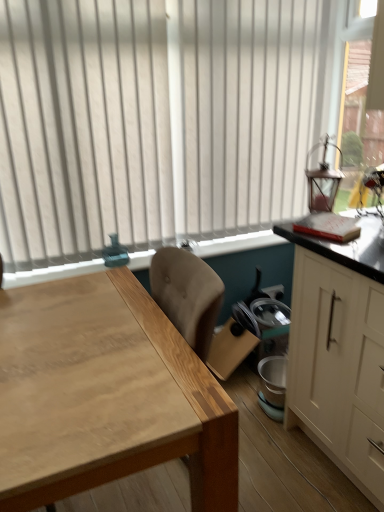
What do you see at coordinates (339, 351) in the screenshot? I see `white matte cabinet at right` at bounding box center [339, 351].

Measure the distance between natural wood table at center and camera.

natural wood table at center and camera are 29.27 inches apart from each other.

You are a GUI agent. You are given a task and a screenshot of the screen. Output one action in this format:
    pyautogui.click(x=<x>, y=<y>)
    Task: Click on the white matte cabinet at right
    
    Given the screenshot: What is the action you would take?
    pyautogui.click(x=339, y=351)

Is white vertical blinds at upper center in contact with white matte cabinet at right?

No, white vertical blinds at upper center is not in contact with white matte cabinet at right.

Is white vertical blinds at upper center thinner than white matte cabinet at right?

Correct, the width of white vertical blinds at upper center is less than that of white matte cabinet at right.

At what (x,y) coordinates should I click in order to perform the action: click on window on the left of white matte cabinet at right. Please return your answer as a coordinate pair (x, y). Looking at the image, I should click on (153, 121).

Based on their positions, is white vertical blinds at upper center located to the left or right of white matte cabinet at right?

From the image, it's evident that white vertical blinds at upper center is to the left of white matte cabinet at right.

Would you say natural wood table at center is to the left or to the right of white matte cabinet at right in the picture?

Clearly, natural wood table at center is on the left of white matte cabinet at right in the image.

Considering the relative sizes of natural wood table at center and white matte cabinet at right in the image provided, is natural wood table at center smaller than white matte cabinet at right?

Incorrect, natural wood table at center is not smaller in size than white matte cabinet at right.

Consider the image. Considering the sizes of objects natural wood table at center and white matte cabinet at right in the image provided, who is wider, natural wood table at center or white matte cabinet at right?

Wider between the two is natural wood table at center.

Can you confirm if natural wood table at center is taller than white matte cabinet at right?

In fact, natural wood table at center may be shorter than white matte cabinet at right.

Does natural wood table at center appear on the left side of clear glass lantern at upper right?

Yes.

Considering the sizes of objects natural wood table at center and clear glass lantern at upper right in the image provided, who is bigger, natural wood table at center or clear glass lantern at upper right?

natural wood table at center.

Considering the sizes of objects natural wood table at center and clear glass lantern at upper right in the image provided, who is shorter, natural wood table at center or clear glass lantern at upper right?

natural wood table at center.

Looking at this image, between natural wood table at center and clear glass lantern at upper right, which one has larger width?

With larger width is natural wood table at center.

Is natural wood table at center inside the boundaries of white vertical blinds at upper center, or outside?

natural wood table at center is not inside white vertical blinds at upper center, it's outside.

How different are the orientations of natural wood table at center and white vertical blinds at upper center in degrees?

The facing directions of natural wood table at center and white vertical blinds at upper center are 1.5 degrees apart.

Identify the location of table in front of the white vertical blinds at upper center. (105, 395).

Which is behind, natural wood table at center or white vertical blinds at upper center?

Positioned behind is white vertical blinds at upper center.

I want to click on window above the white matte cabinet at right (from a real-world perspective), so click(x=153, y=121).

From the image's perspective, which object appears higher, white matte cabinet at right or white vertical blinds at upper center?

white vertical blinds at upper center.

Is white matte cabinet at right located outside white vertical blinds at upper center?

Yes, white matte cabinet at right is outside of white vertical blinds at upper center.

What's the angular difference between white matte cabinet at right and white vertical blinds at upper center's facing directions?

90 degrees.

From a real-world perspective, which object rests below the other?

From a 3D spatial view, white matte cabinet at right is below.

Where is `window screen above the white matte cabinet at right (from a real-world perspective)`? window screen above the white matte cabinet at right (from a real-world perspective) is located at coordinates (360, 88).

In the image, is white matte cabinet at right positioned in front of or behind clear glass lantern at upper right?

Visually, white matte cabinet at right is located in front of clear glass lantern at upper right.

From the image's perspective, is white matte cabinet at right on clear glass lantern at upper right?

No, from the image's perspective, white matte cabinet at right is not above clear glass lantern at upper right.

Is white matte cabinet at right wider or thinner than natural wood table at center?

white matte cabinet at right is thinner than natural wood table at center.

Find the location of `cabinetry on the right of natural wood table at center`. cabinetry on the right of natural wood table at center is located at coordinates (339, 351).

Is white matte cabinet at right in contact with natural wood table at center?

white matte cabinet at right and natural wood table at center are not in contact.

Locate an element on the screen. This screenshot has height=512, width=384. cabinetry on the right of the white vertical blinds at upper center is located at coordinates (339, 351).

Locate an element on the screen. The height and width of the screenshot is (512, 384). table on the left of white matte cabinet at right is located at coordinates [105, 395].

From the image, which object appears to be nearer to natural wood table at center, clear glass lantern at upper right or white matte cabinet at right?

Among the two, white matte cabinet at right is located nearer to natural wood table at center.

When comparing their distances from white matte cabinet at right, does white vertical blinds at upper center or natural wood table at center seem further?

Among the two, white vertical blinds at upper center is located further to white matte cabinet at right.

Considering their positions, is white matte cabinet at right positioned closer to clear glass lantern at upper right than natural wood table at center?

white matte cabinet at right is closer to clear glass lantern at upper right.

Based on their spatial positions, is clear glass lantern at upper right or white vertical blinds at upper center closer to white matte cabinet at right?

clear glass lantern at upper right is positioned closer to the anchor white matte cabinet at right.

When comparing their distances from clear glass lantern at upper right, does white vertical blinds at upper center or white matte cabinet at right seem closer?

white vertical blinds at upper center.

From the image, which object appears to be nearer to clear glass lantern at upper right, natural wood table at center or white matte cabinet at right?

Based on the image, white matte cabinet at right appears to be nearer to clear glass lantern at upper right.

Considering their positions, is white matte cabinet at right positioned further to clear glass lantern at upper right than white vertical blinds at upper center?

Among the two, white matte cabinet at right is located further to clear glass lantern at upper right.

Which object lies further to the anchor point white vertical blinds at upper center, natural wood table at center or white matte cabinet at right?

white matte cabinet at right.

Where is `window between clear glass lantern at upper right and white matte cabinet at right in the vertical direction`? The image size is (384, 512). window between clear glass lantern at upper right and white matte cabinet at right in the vertical direction is located at coordinates (153, 121).

I want to click on window between clear glass lantern at upper right and natural wood table at center from top to bottom, so click(153, 121).

At what (x,y) coordinates should I click in order to perform the action: click on cabinetry between clear glass lantern at upper right and natural wood table at center in the vertical direction. Please return your answer as a coordinate pair (x, y). Looking at the image, I should click on (339, 351).

Where is `cabinetry between white vertical blinds at upper center and natural wood table at center in the up-down direction`? The image size is (384, 512). cabinetry between white vertical blinds at upper center and natural wood table at center in the up-down direction is located at coordinates 339,351.